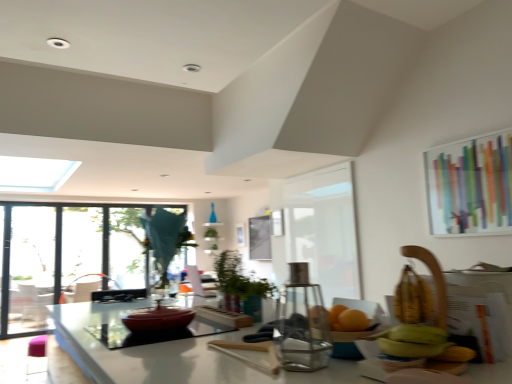
At what (x,y) coordinates should I click in order to perform the action: click on clear glass screen door at left, which is the 2th screen door from right to left. Please return your answer as a coordinate pair (x, y). This screenshot has height=384, width=512. Looking at the image, I should click on (27, 269).

At what (x,y) coordinates should I click in order to perform the action: click on white matte screen door at center, which is counted as the second screen door, starting from the back. Please return your answer as a coordinate pair (x, y). Looking at the image, I should click on (324, 229).

What do you see at coordinates (137, 326) in the screenshot? Image resolution: width=512 pixels, height=384 pixels. I see `transparent glass table at center` at bounding box center [137, 326].

You are a GUI agent. You are given a task and a screenshot of the screen. Output one action in this format:
    pyautogui.click(x=<x>, y=<y>)
    Task: Click on the colorful glass window screen at upper right
    Image resolution: width=512 pixels, height=384 pixels.
    Given the screenshot: What is the action you would take?
    pyautogui.click(x=470, y=185)

Considering the points (230, 289) and (497, 176), which point is behind, point (230, 289) or point (497, 176)?

Point (497, 176)

From the image's perspective, would you say green matte plant at center is positioned over colorful glass window screen at upper right?

Incorrect, from the image's perspective, green matte plant at center is lower than colorful glass window screen at upper right.

Find the location of a particular element. The image size is (512, 384). window screen lying on the right of green matte plant at center is located at coordinates [470, 185].

Considering the positions of objects white matte screen door at center, the 1th screen door viewed from the front, and transparent glass window at left in the image provided, who is more to the right, white matte screen door at center, the 1th screen door viewed from the front, or transparent glass window at left?

white matte screen door at center, the 1th screen door viewed from the front.

Is white matte screen door at center, placed as the second screen door when sorted from left to right, turned away from transparent glass window at left?

No.

Is point (292, 204) farther from viewer compared to point (77, 213)?

That is False.

Considering the relative sizes of white matte screen door at center, which is counted as the second screen door, starting from the back, and transparent glass window at left in the image provided, is white matte screen door at center, which is counted as the second screen door, starting from the back, taller than transparent glass window at left?

No, white matte screen door at center, which is counted as the second screen door, starting from the back, is not taller than transparent glass window at left.

From the image's perspective, which is above, transparent glass window at left or white matte screen door at center, which is counted as the second screen door, starting from the back?

white matte screen door at center, which is counted as the second screen door, starting from the back.

Is white matte screen door at center, placed as the second screen door when sorted from left to right, at the back of transparent glass window at left?

No, transparent glass window at left is not facing the opposite direction of white matte screen door at center, placed as the second screen door when sorted from left to right.

Which object is positioned more to the left, transparent glass window at left or white matte screen door at center, the 1th screen door viewed from the front?

Positioned to the left is transparent glass window at left.

Is transparent glass window at left behind white matte screen door at center, the 1th screen door viewed from the front?

Yes, the depth of transparent glass window at left is greater than that of white matte screen door at center, the 1th screen door viewed from the front.

Is white matte screen door at center, which is counted as the second screen door, starting from the back, inside or outside of green matte plant at center?

white matte screen door at center, which is counted as the second screen door, starting from the back, is spatially situated outside green matte plant at center.

Are white matte screen door at center, which is counted as the second screen door, starting from the back, and green matte plant at center far apart?

Yes, white matte screen door at center, which is counted as the second screen door, starting from the back, is far from green matte plant at center.

Does white matte screen door at center, the 1th screen door viewed from the right, lie behind green matte plant at center?

Yes, white matte screen door at center, the 1th screen door viewed from the right, is further from the camera.

Would you say white matte screen door at center, the 1th screen door viewed from the front, is to the left or to the right of green matte plant at center in the picture?

white matte screen door at center, the 1th screen door viewed from the front, is positioned on green matte plant at center's right side.

Which is more to the right, colorful glass window screen at upper right or white matte screen door at center, the 1th screen door viewed from the right?

colorful glass window screen at upper right is more to the right.

Which object is thinner, colorful glass window screen at upper right or white matte screen door at center, the 1th screen door viewed from the right?

Thinner between the two is colorful glass window screen at upper right.

Is colorful glass window screen at upper right positioned with its back to white matte screen door at center, the 1th screen door viewed from the right?

No, white matte screen door at center, the 1th screen door viewed from the right, is not at the back of colorful glass window screen at upper right.

Does colorful glass window screen at upper right have a lesser height compared to white matte screen door at center, the 1th screen door viewed from the right?

Yes, colorful glass window screen at upper right is shorter than white matte screen door at center, the 1th screen door viewed from the right.

How distant is clear glass screen door at left, which is the 2th screen door from right to left, from white matte screen door at center, placed as the second screen door when sorted from left to right?

clear glass screen door at left, which is the 2th screen door from right to left, is 4.04 meters from white matte screen door at center, placed as the second screen door when sorted from left to right.

Can you tell me how much clear glass screen door at left, the second screen door when ordered from front to back, and white matte screen door at center, placed as the second screen door when sorted from left to right, differ in facing direction?

The angular difference between clear glass screen door at left, the second screen door when ordered from front to back, and white matte screen door at center, placed as the second screen door when sorted from left to right, is 94.4 degrees.

Considering the sizes of objects clear glass screen door at left, the second screen door when ordered from front to back, and white matte screen door at center, the 1th screen door viewed from the front, in the image provided, who is taller, clear glass screen door at left, the second screen door when ordered from front to back, or white matte screen door at center, the 1th screen door viewed from the front,?

clear glass screen door at left, the second screen door when ordered from front to back.

From a real-world perspective, is clear glass screen door at left, which is the first screen door from back to front, beneath white matte screen door at center, placed as the second screen door when sorted from left to right?

Yes, from a real-world perspective, clear glass screen door at left, which is the first screen door from back to front, is under white matte screen door at center, placed as the second screen door when sorted from left to right.

In the scene shown: Considering the sizes of green matte plant at center and white matte screen door at center, placed as the second screen door when sorted from left to right, in the image, is green matte plant at center wider or thinner than white matte screen door at center, placed as the second screen door when sorted from left to right,?

green matte plant at center is wider than white matte screen door at center, placed as the second screen door when sorted from left to right.

Considering the positions of objects green matte plant at center and white matte screen door at center, placed as the second screen door when sorted from left to right, in the image provided, who is behind, green matte plant at center or white matte screen door at center, placed as the second screen door when sorted from left to right,?

white matte screen door at center, placed as the second screen door when sorted from left to right, is further away from the camera.

Is white matte screen door at center, the 1th screen door viewed from the right, surrounded by green matte plant at center?

No, white matte screen door at center, the 1th screen door viewed from the right, is not surrounded by green matte plant at center.

Locate an element on the screen. window screen above the green matte plant at center (from a real-world perspective) is located at coordinates (470, 185).

Identify the location of screen door that is on the right side of transparent glass window at left. (324, 229).

Based on their spatial positions, is white matte screen door at center, the 1th screen door viewed from the front, or transparent glass table at center further from green matte plant at center?

white matte screen door at center, the 1th screen door viewed from the front, is positioned further to the anchor green matte plant at center.

Which object lies nearer to the anchor point transparent glass table at center, white matte screen door at center, the 1th screen door viewed from the front, or clear glass screen door at left, the second screen door when ordered from front to back?

Among the two, white matte screen door at center, the 1th screen door viewed from the front, is located nearer to transparent glass table at center.

When comparing their distances from colorful glass window screen at upper right, does green matte plant at center or white matte screen door at center, placed as the second screen door when sorted from left to right, seem closer?

white matte screen door at center, placed as the second screen door when sorted from left to right, is closer to colorful glass window screen at upper right.

Based on their spatial positions, is transparent glass window at left or colorful glass window screen at upper right further from clear glass screen door at left, the second screen door when ordered from front to back?

colorful glass window screen at upper right is positioned further to the anchor clear glass screen door at left, the second screen door when ordered from front to back.

Estimate the real-world distances between objects in this image. Which object is closer to colorful glass window screen at upper right, transparent glass window at left or transparent glass table at center?

The object closer to colorful glass window screen at upper right is transparent glass table at center.

Based on their spatial positions, is green matte plant at center or transparent glass window at left closer to transparent glass table at center?

Based on the image, green matte plant at center appears to be nearer to transparent glass table at center.

Based on their spatial positions, is white matte screen door at center, the 1th screen door viewed from the right, or transparent glass table at center further from transparent glass window at left?

The object further to transparent glass window at left is transparent glass table at center.

Considering their positions, is colorful glass window screen at upper right positioned closer to clear glass screen door at left, which is the 2th screen door from right to left, than white matte screen door at center, the 1th screen door viewed from the right?

The object closer to clear glass screen door at left, which is the 2th screen door from right to left, is white matte screen door at center, the 1th screen door viewed from the right.

Find the location of a particular element. The height and width of the screenshot is (384, 512). window between clear glass screen door at left, the second screen door when ordered from front to back, and colorful glass window screen at upper right is located at coordinates (72, 258).

I want to click on window screen between transparent glass table at center and white matte screen door at center, the 1th screen door viewed from the right, from front to back, so 470,185.

Identify the location of screen door between clear glass screen door at left, the second screen door when ordered from front to back, and colorful glass window screen at upper right. This screenshot has width=512, height=384. (324, 229).

I want to click on screen door positioned between green matte plant at center and transparent glass window at left from near to far, so click(324, 229).